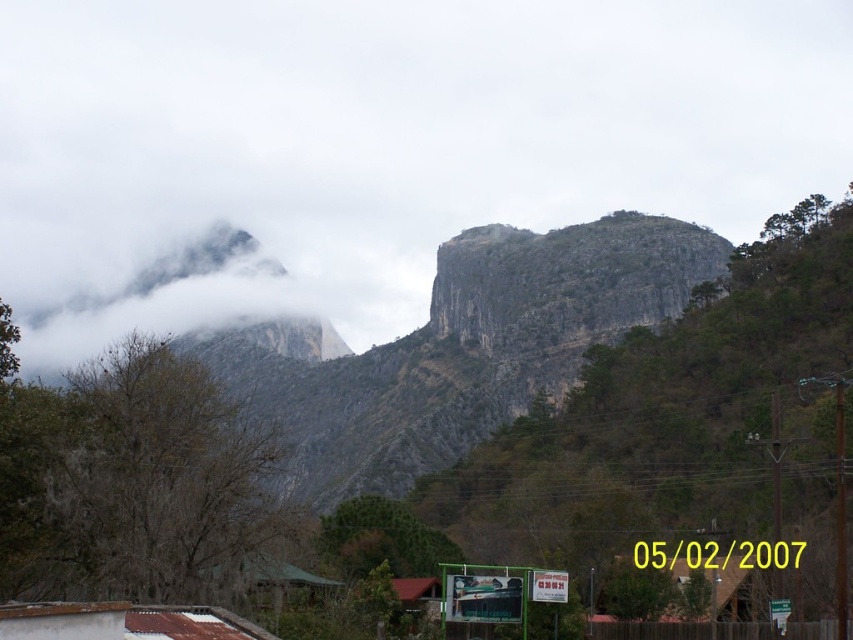
Question: Is rugged stone mountain at upper center positioned in front of white fluffy cloud at left?

Choices:
 (A) no
 (B) yes

Answer: (B)

Question: Does rugged stone mountain at upper center have a larger size compared to white fluffy cloud at left?

Choices:
 (A) yes
 (B) no

Answer: (A)

Question: Can you confirm if rugged stone mountain at upper center is positioned to the right of white fluffy cloud at left?

Choices:
 (A) no
 (B) yes

Answer: (B)

Question: Which object appears closest to the camera in this image?

Choices:
 (A) white fluffy cloud at left
 (B) rugged stone mountain at upper center

Answer: (B)

Question: Which point is closer to the camera?

Choices:
 (A) white fluffy cloud at left
 (B) rugged stone mountain at upper center

Answer: (B)